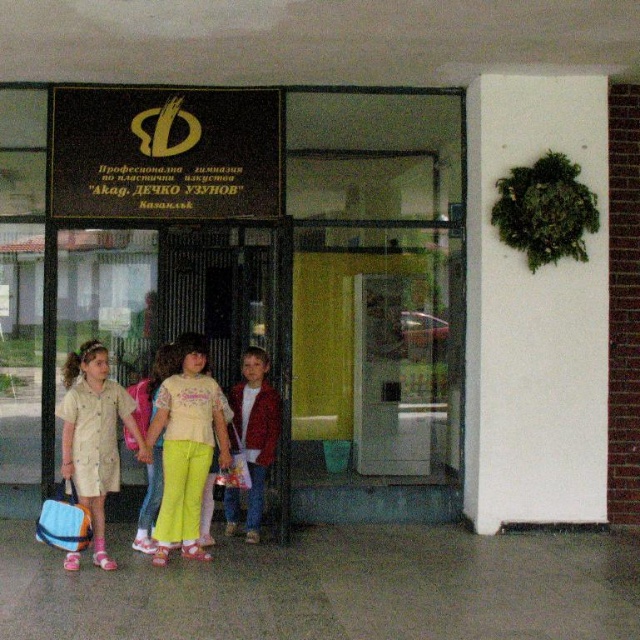
In the scene shown: Does beige cotton dress at center have a smaller size compared to red velvet jacket at center?

Actually, beige cotton dress at center might be larger than red velvet jacket at center.

Does beige cotton dress at center appear on the right side of red velvet jacket at center?

No, beige cotton dress at center is not to the right of red velvet jacket at center.

Identify the location of beige cotton dress at center. The height and width of the screenshot is (640, 640). (93, 435).

You are a GUI agent. You are given a task and a screenshot of the screen. Output one action in this format:
    pyautogui.click(x=<x>, y=<y>)
    Task: Click on the beige cotton dress at center
    This screenshot has width=640, height=640.
    Given the screenshot: What is the action you would take?
    pyautogui.click(x=93, y=435)

Is light yellow cotton shirt at center positioned before red velvet jacket at center?

Yes.

At what (x,y) coordinates should I click in order to perform the action: click on light yellow cotton shirt at center. Please return your answer as a coordinate pair (x, y). This screenshot has height=640, width=640. Looking at the image, I should click on (186, 448).

Describe the element at coordinates (186, 448) in the screenshot. I see `light yellow cotton shirt at center` at that location.

Where is `light yellow cotton shirt at center`? The height and width of the screenshot is (640, 640). light yellow cotton shirt at center is located at coordinates (186, 448).

Can you confirm if light yellow cotton shirt at center is positioned to the right of beige cotton dress at center?

Indeed, light yellow cotton shirt at center is positioned on the right side of beige cotton dress at center.

Can you confirm if light yellow cotton shirt at center is positioned below beige cotton dress at center?

Actually, light yellow cotton shirt at center is above beige cotton dress at center.

Is point (152, 433) more distant than point (74, 397)?

Yes, point (152, 433) is behind point (74, 397).

This screenshot has width=640, height=640. What are the coordinates of `light yellow cotton shirt at center` in the screenshot? It's located at (186, 448).